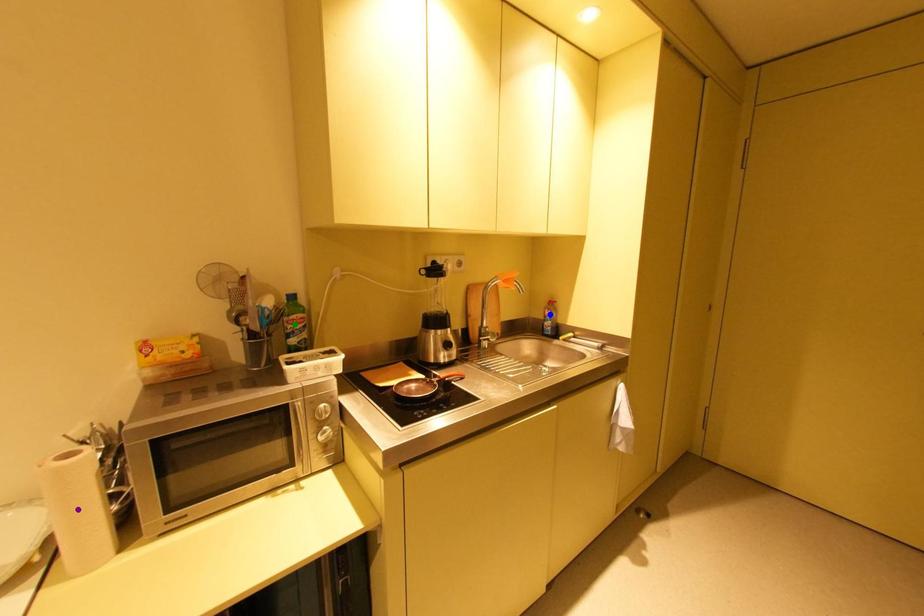
Order these from nearest to farthest:
- blue point
- purple point
- green point

blue point, green point, purple point